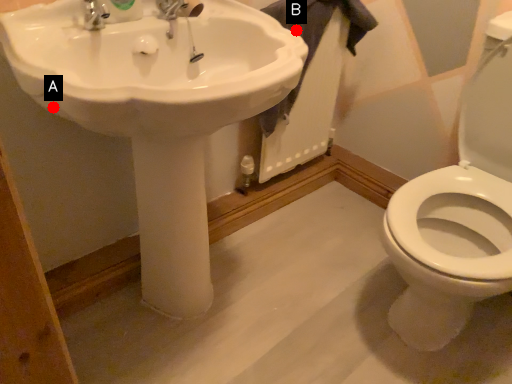
Question: Two points are circled on the image, labeled by A and B beside each circle. Which point appears closest to the camera in this image?

Choices:
 (A) A is closer
 (B) B is closer

Answer: (A)